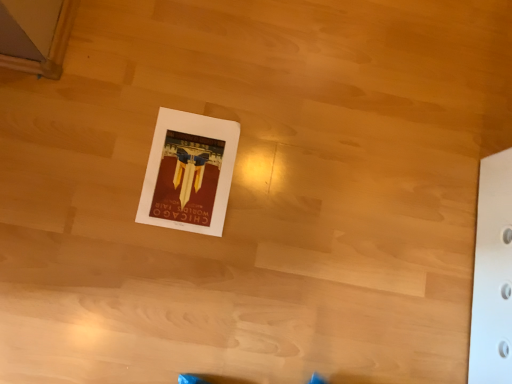
The width and height of the screenshot is (512, 384). I want to click on blank space situated above matte white picture frame at center (from a real-world perspective), so click(193, 168).